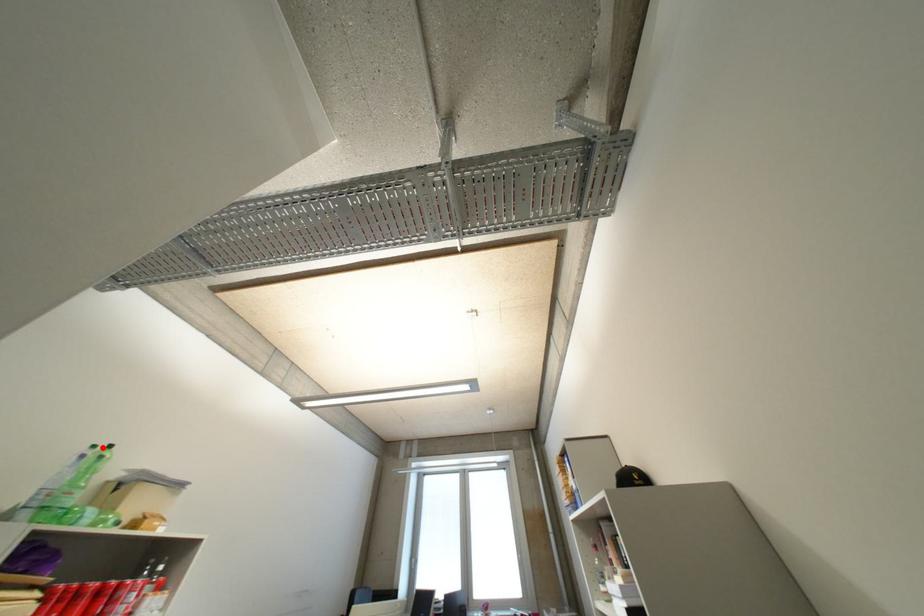
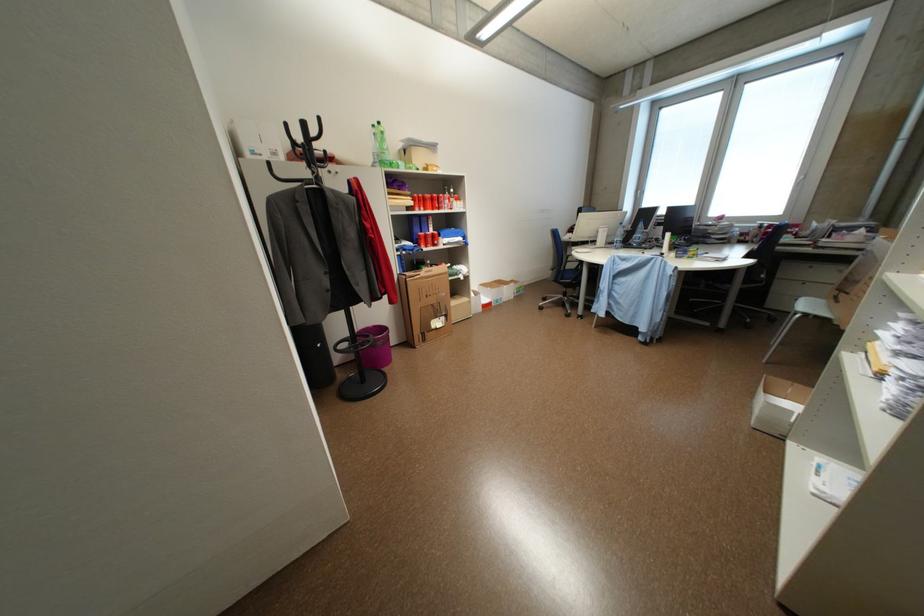
The point at the highlighted location is marked in the first image. Where is the corresponding point in the second image?

(382, 127)